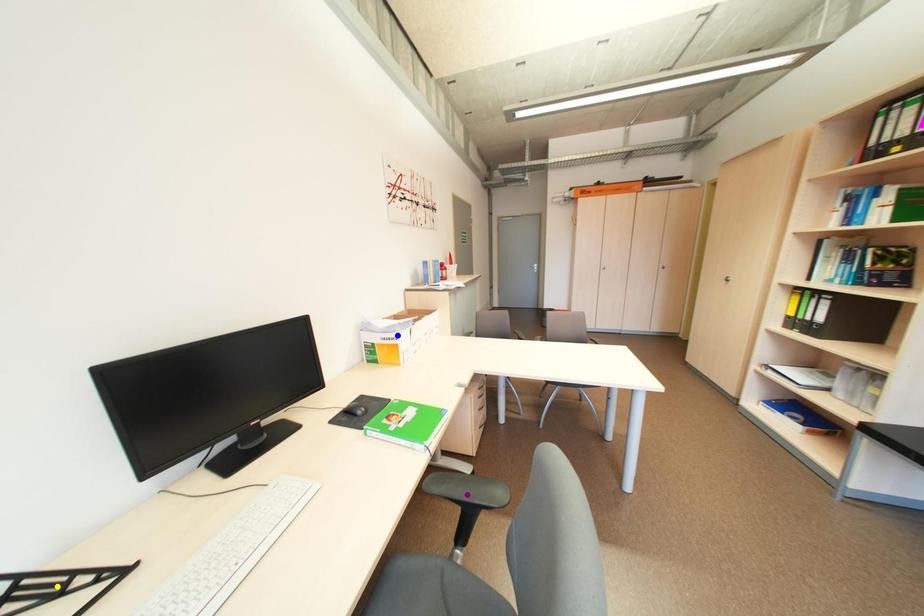
Order these from nearest to farthest:
purple point
yellow point
blue point

blue point → purple point → yellow point